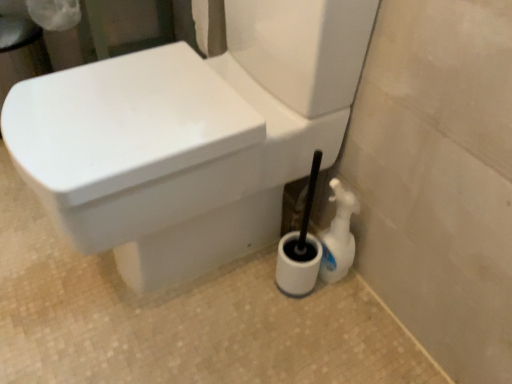
At what (x,y) coordinates should I click in order to perform the action: click on vacant region to the left of white plastic spray bottle at lower right. Please return your answer as a coordinate pair (x, y). Looking at the image, I should click on (251, 282).